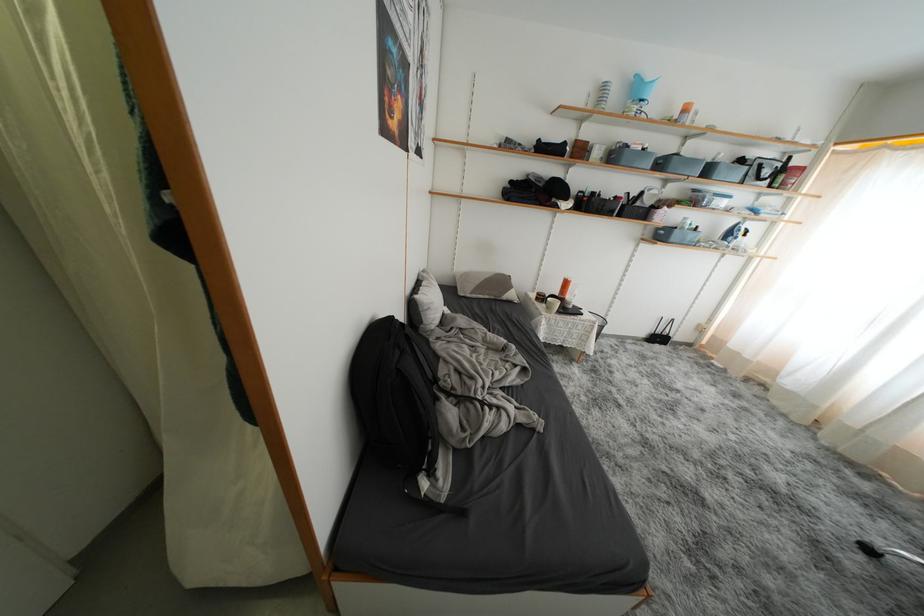
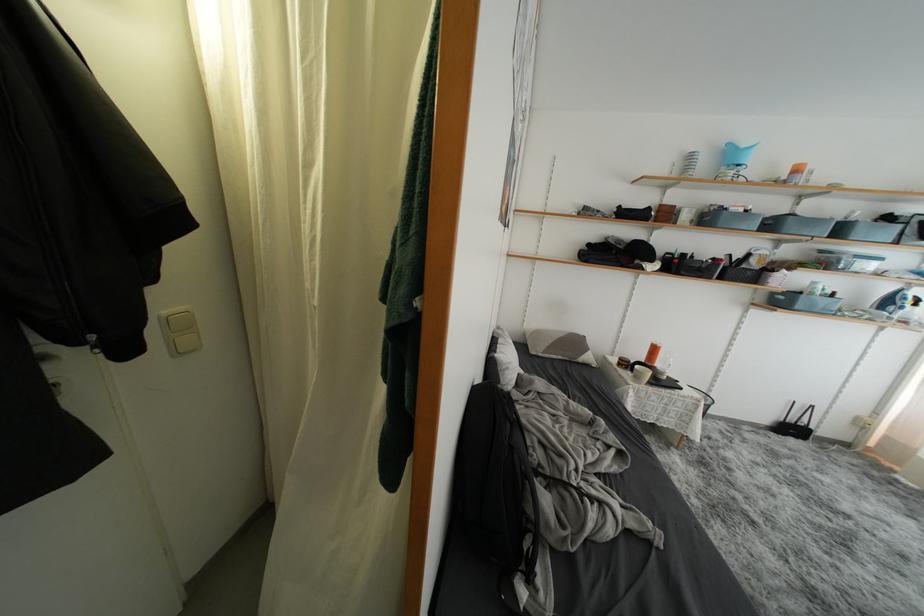
The point at (x=654, y=83) is marked in the first image. Where is the corresponding point in the second image?

(749, 150)